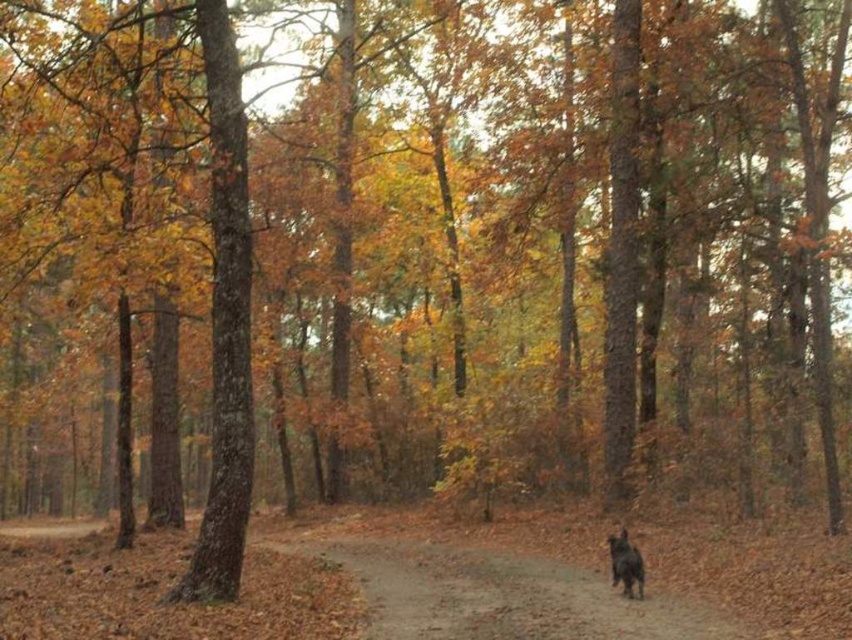
Can you confirm if brown dirt path at center is positioned to the left of black furry dog at lower right?

Indeed, brown dirt path at center is positioned on the left side of black furry dog at lower right.

What are the coordinates of `brown dirt path at center` in the screenshot? It's located at (499, 593).